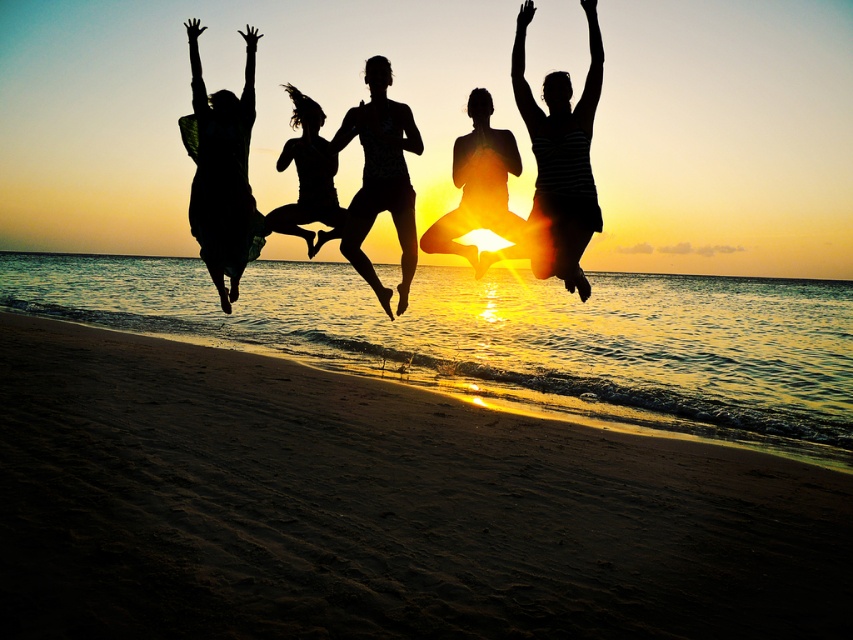
Can you confirm if sandy beach at lower center is wider than matte black bikini at center?

Yes.

Does point (720, 474) come in front of point (368, 64)?

No, (720, 474) is behind (368, 64).

Is point (51, 522) closer to camera compared to point (404, 230)?

Yes, it is in front of point (404, 230).

Where is `sandy beach at lower center`? Image resolution: width=853 pixels, height=640 pixels. sandy beach at lower center is located at coordinates (376, 509).

Who is more distant from viewer, (x=546, y=161) or (x=302, y=216)?

Point (x=302, y=216)

Which is more to the left, striped fabric person at upper right or black matte figure at center?

From the viewer's perspective, black matte figure at center appears more on the left side.

Describe the element at coordinates (560, 157) in the screenshot. The image size is (853, 640). I see `striped fabric person at upper right` at that location.

At what (x,y) coordinates should I click in order to perform the action: click on striped fabric person at upper right. Please return your answer as a coordinate pair (x, y). Looking at the image, I should click on (560, 157).

Which of these two, black fabric dress at left or black matte figure at center, stands taller?

black fabric dress at left is taller.

Between point (181, 124) and point (312, 160), which one is positioned in front?

Point (312, 160)

I want to click on black fabric dress at left, so click(x=222, y=170).